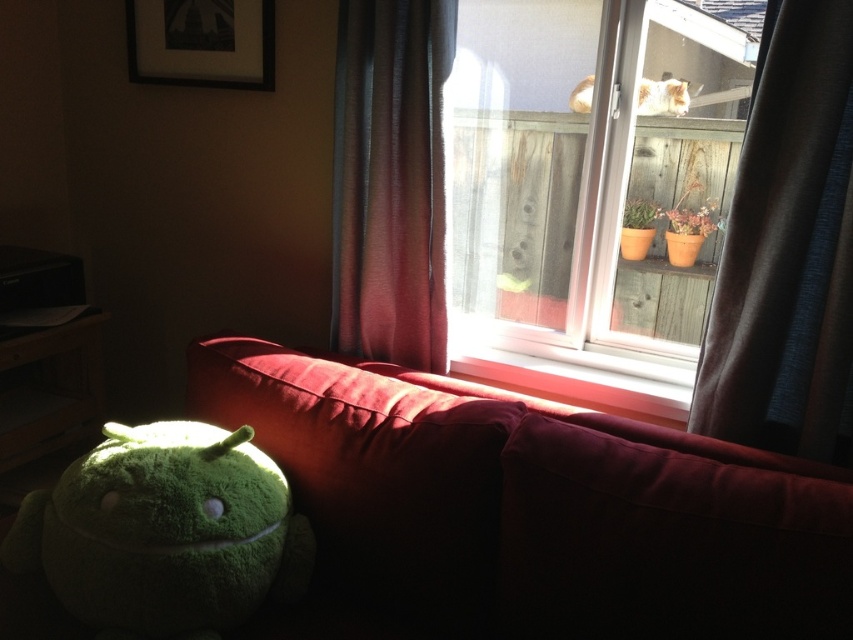
Can you confirm if smooth wood window sill at center is shorter than white fluffy cat at upper center?

Incorrect, smooth wood window sill at center's height does not fall short of white fluffy cat at upper center's.

Can you confirm if smooth wood window sill at center is smaller than white fluffy cat at upper center?

No, smooth wood window sill at center is not smaller than white fluffy cat at upper center.

Does point (532, 374) come closer to viewer compared to point (641, 92)?

No, it is not.

Where is `smooth wood window sill at center`? The width and height of the screenshot is (853, 640). smooth wood window sill at center is located at coordinates (573, 380).

Can you confirm if velvet-like burgundy curtain at center is thinner than smooth wood window sill at center?

Yes.

Can you confirm if velvet-like burgundy curtain at center is bigger than smooth wood window sill at center?

Yes.

Between point (425, 308) and point (608, 392), which one is positioned behind?

The point (425, 308) is more distant.

Image resolution: width=853 pixels, height=640 pixels. Find the location of `velvet-like burgundy curtain at center`. velvet-like burgundy curtain at center is located at coordinates (392, 180).

How far apart are velvet red couch at lower left and smooth wood window sill at center?

velvet red couch at lower left and smooth wood window sill at center are 19.55 inches apart from each other.

The width and height of the screenshot is (853, 640). What do you see at coordinates (534, 506) in the screenshot? I see `velvet red couch at lower left` at bounding box center [534, 506].

Image resolution: width=853 pixels, height=640 pixels. In order to click on velvet red couch at lower left in this screenshot , I will do `click(534, 506)`.